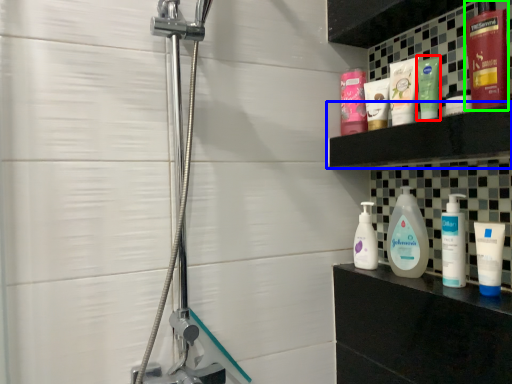
Question: Based on their relative distances, which object is nearer to toiletry (highlighted by a red box)? Choose from shelf (highlighted by a blue box) and toiletry (highlighted by a green box).

Choices:
 (A) shelf
 (B) toiletry

Answer: (A)